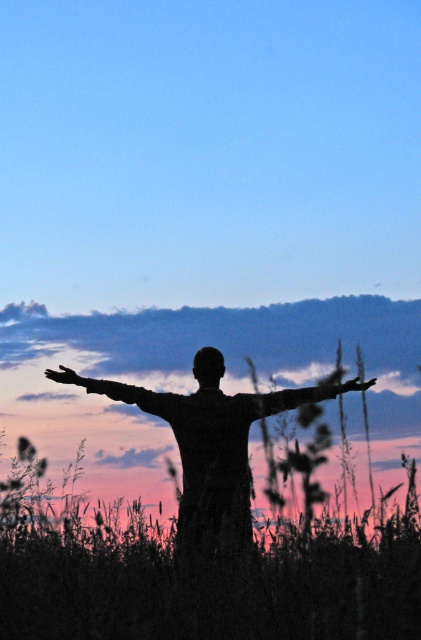
Question: Is green grassy at center below smooth skin hand at upper center?

Choices:
 (A) yes
 (B) no

Answer: (A)

Question: Which of the following is the farthest from the observer?

Choices:
 (A) (320, 538)
 (B) (231, 424)

Answer: (B)

Question: Which of these objects is positioned closest to the silhouette arm at center?

Choices:
 (A) silvery metallic arm at center
 (B) smooth skin hand at upper center

Answer: (A)

Question: Does silhouette figure at center appear under smooth skin hand at upper center?

Choices:
 (A) no
 (B) yes

Answer: (B)

Question: Does silhouette arm at center appear over matte black hand at upper left?

Choices:
 (A) no
 (B) yes

Answer: (A)

Question: Which point is farther from the camera taking this photo?

Choices:
 (A) (362, 384)
 (B) (264, 394)
 (C) (93, 392)

Answer: (C)